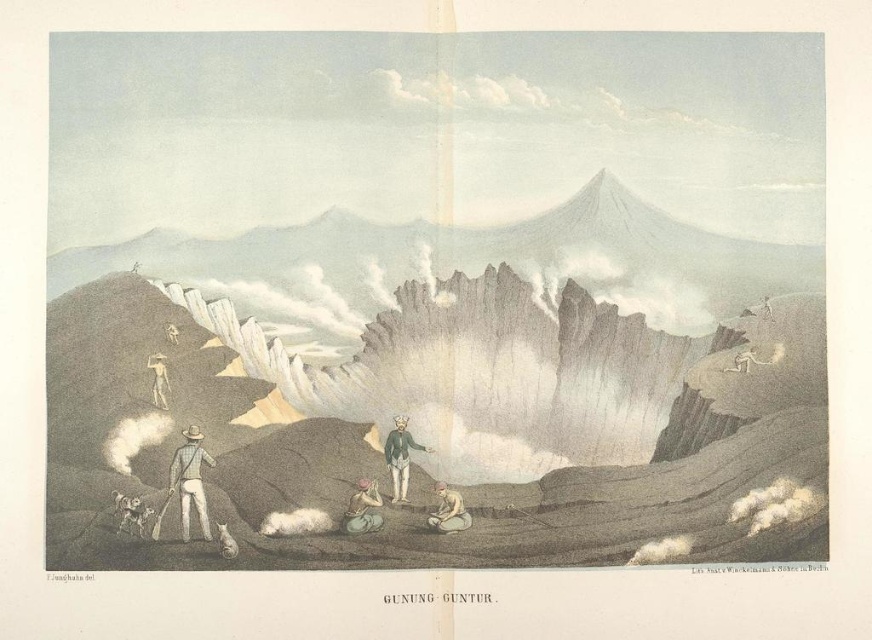
Does brown textured cloth at center have a greater width compared to light brown skin at center?

No.

Can you confirm if brown textured cloth at center is positioned to the right of light brown skin at center?

Incorrect, brown textured cloth at center is not on the right side of light brown skin at center.

Which is behind, point (380, 522) or point (440, 525)?

Point (440, 525)

This screenshot has height=640, width=872. I want to click on brown textured cloth at center, so click(363, 508).

How far apart are blue striped shirt at lower left and light brown wooden stick at left?

They are 4.12 inches apart.

Can you confirm if blue striped shirt at lower left is positioned to the left of light brown wooden stick at left?

No, blue striped shirt at lower left is not to the left of light brown wooden stick at left.

Find the location of a particular element. Image resolution: width=872 pixels, height=640 pixels. blue striped shirt at lower left is located at coordinates (189, 481).

Image resolution: width=872 pixels, height=640 pixels. What are the coordinates of `blue striped shirt at lower left` in the screenshot? It's located at 189,481.

Does green fabric jacket at center appear on the right side of light brown wooden stick at left?

Correct, you'll find green fabric jacket at center to the right of light brown wooden stick at left.

Who is more forward, (402, 476) or (155, 362)?

Point (155, 362) is more forward.

The image size is (872, 640). What do you see at coordinates (399, 456) in the screenshot?
I see `green fabric jacket at center` at bounding box center [399, 456].

Find the location of `green fabric jacket at center`. green fabric jacket at center is located at coordinates (399, 456).